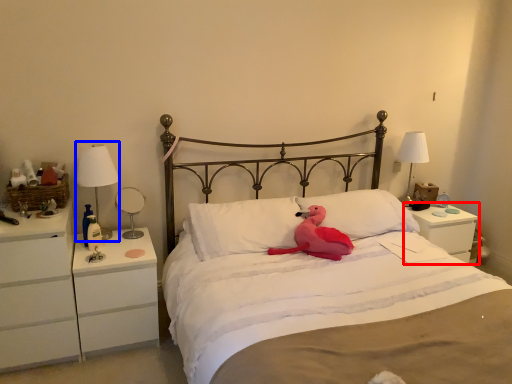
Question: Which point is further to the camera, nightstand (highlighted by a red box) or bedside lamp (highlighted by a blue box)?

Choices:
 (A) nightstand
 (B) bedside lamp

Answer: (A)